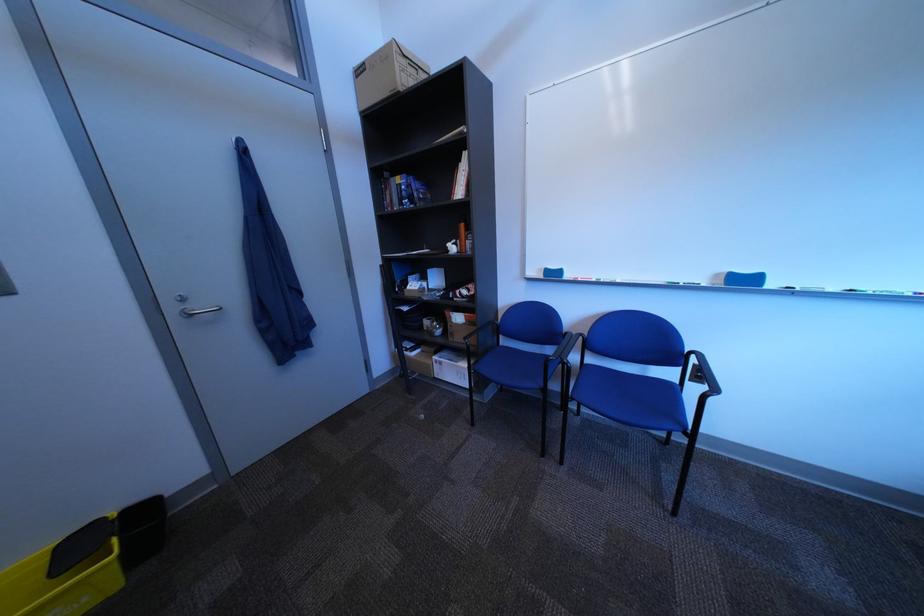
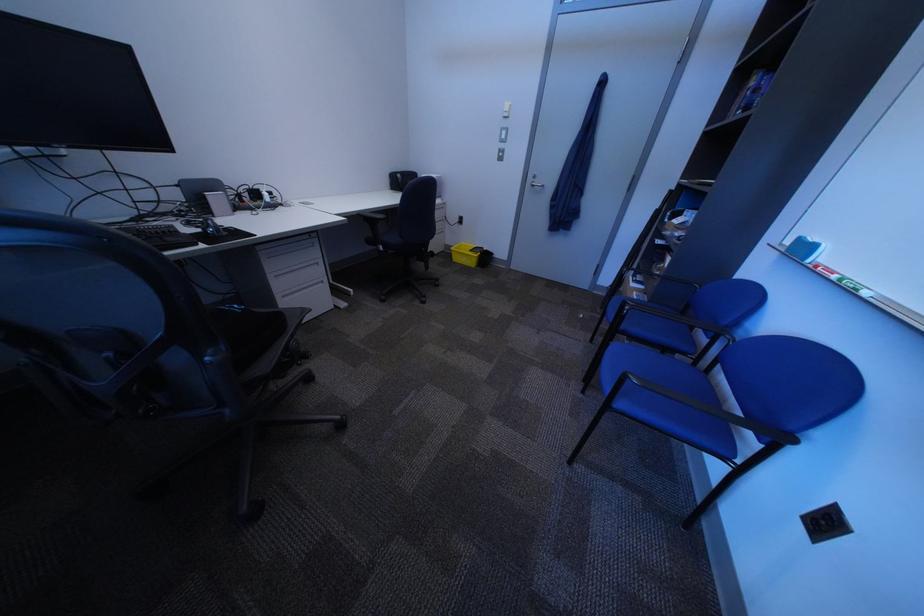
In the second image, find the point that corresponds to point (440, 418) in the first image.

(599, 318)